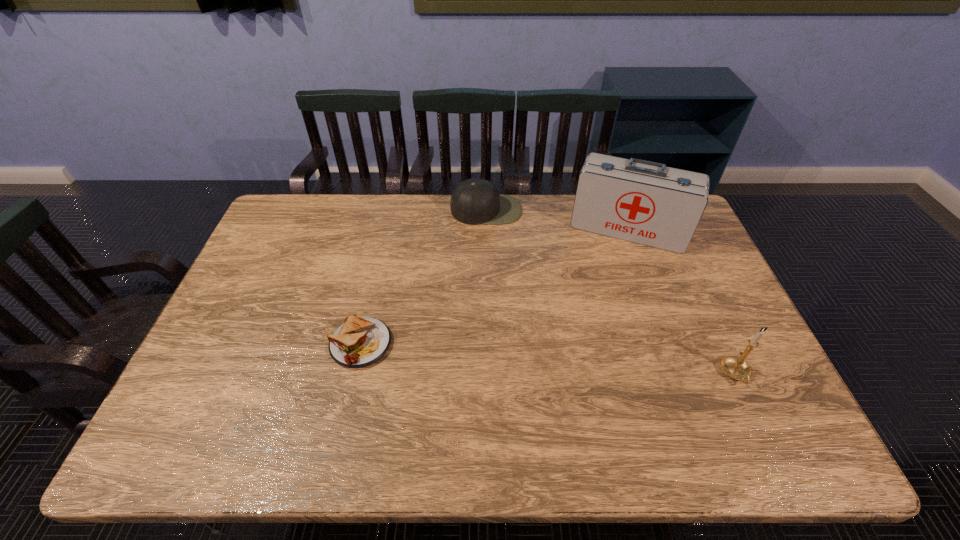
Where is `free space between the cap and the candle holder`? The image size is (960, 540). free space between the cap and the candle holder is located at coordinates (611, 292).

Locate an element on the screen. unoccupied position between the leftmost object and the second object from left to right is located at coordinates (423, 276).

Find the location of a particular element. free space that is in between the tallest object and the second object from left to right is located at coordinates (557, 220).

Where is `free space between the leftmost object and the tallest object`? The height and width of the screenshot is (540, 960). free space between the leftmost object and the tallest object is located at coordinates (494, 287).

This screenshot has height=540, width=960. Identify the location of vacant space that is in between the third shortest object and the second object from left to right. (611, 292).

Locate an element on the screen. The width and height of the screenshot is (960, 540). object that is the second closest to the leftmost object is located at coordinates (644, 202).

Find the location of a particular element. the third closest object to the leftmost object is located at coordinates (736, 367).

This screenshot has width=960, height=540. Identify the location of free location that satisfies the following two spatial constraints: 1. on the back side of the sandwich; 2. on the left side of the second shortest object. (391, 210).